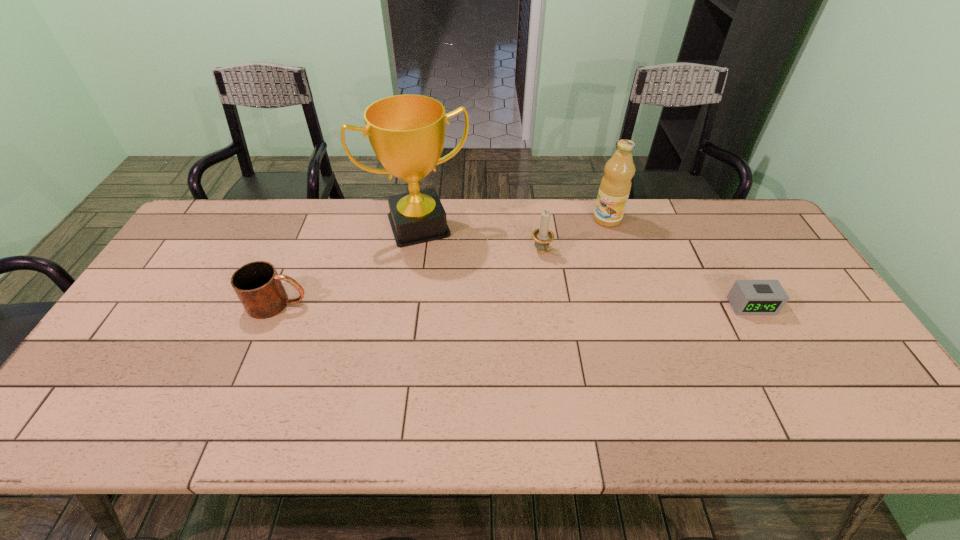
You are a GUI agent. You are given a task and a screenshot of the screen. Output one action in this format:
    pyautogui.click(x=<x>, y=<y>)
    Task: Click on the vacant spot on the desktop that is between the leftmost object and the shortest object and is positioned on the front-facing side of the award
    The image size is (960, 540).
    Given the screenshot: What is the action you would take?
    pyautogui.click(x=448, y=305)

You are a GUI agent. You are given a task and a screenshot of the screen. Output one action in this format:
    pyautogui.click(x=<x>, y=<y>)
    Task: Click on the free space on the desktop that is between the leftmost object and the alarm clock and is positioned on the handle side of the third shortest object
    
    Given the screenshot: What is the action you would take?
    pyautogui.click(x=584, y=305)

Identify the location of vacant space on the desktop that is between the leftmost object and the shortest object and is positioned on the label of the second object from right to left. Image resolution: width=960 pixels, height=540 pixels. (519, 305).